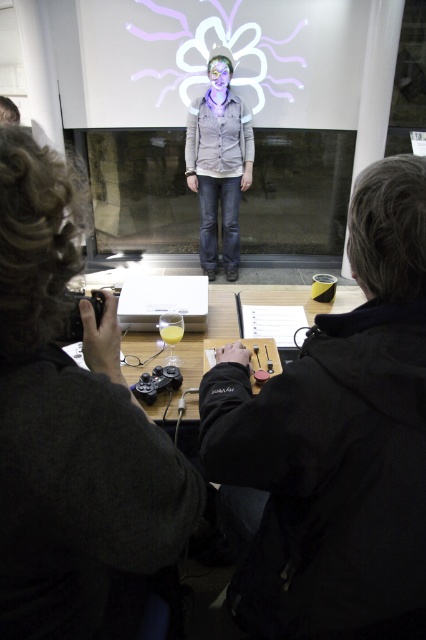
Question: Which point is closer to the camera?

Choices:
 (A) dark gray sweater at lower left
 (B) matte gray shirt at center
 (C) wooden table at center

Answer: (A)

Question: Does matte gray shirt at center come behind white plastic projector at center?

Choices:
 (A) no
 (B) yes

Answer: (B)

Question: Among these points, which one is farthest from the camera?

Choices:
 (A) (178, 508)
 (B) (198, 337)
 (C) (192, 308)

Answer: (C)

Question: Is black matte jacket at center positioned behind wooden table at center?

Choices:
 (A) yes
 (B) no

Answer: (B)

Question: Which point is farther to the camera?

Choices:
 (A) (120, 310)
 (B) (414, 417)
 (C) (218, 61)

Answer: (C)

Question: Considering the relative positions of matte gray shirt at center and white plastic projector at center in the image provided, where is matte gray shirt at center located with respect to white plastic projector at center?

Choices:
 (A) below
 (B) above

Answer: (B)